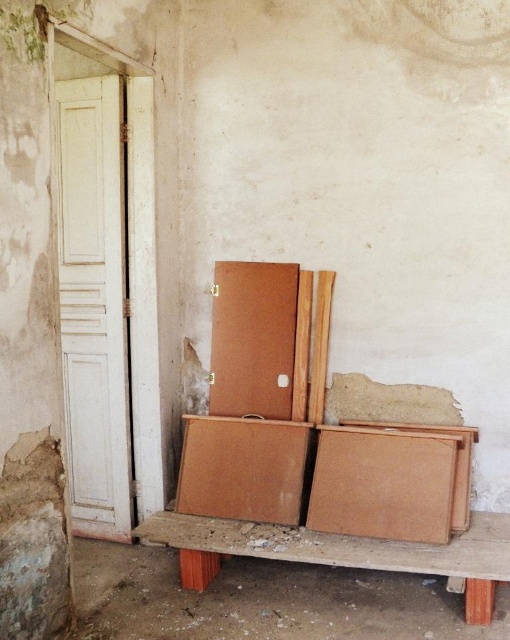
You are organizing items in a room and need to place a new box on the floor. You see the brown cardboard box at lower center and the brown cardboard box at center. Which box is closer to the floor?

The brown cardboard box at lower center is closer to the floor since it is located below the brown cardboard box at center.

You are a delivery person who just arrived at this room and need to place a small package on the tallest object available. Which object should you choose between the wooden bench at lower center and the brown cardboard box at center?

The brown cardboard box at center is taller than the wooden bench at lower center, so you should place the package on the brown cardboard box at center.